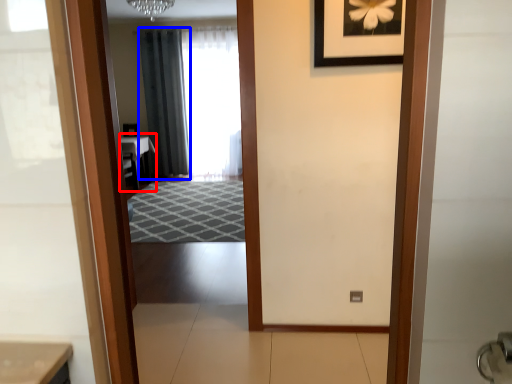
Question: Which of the following is the farthest to the observer, table (highlighted by a red box) or curtain (highlighted by a blue box)?

Choices:
 (A) table
 (B) curtain

Answer: (B)